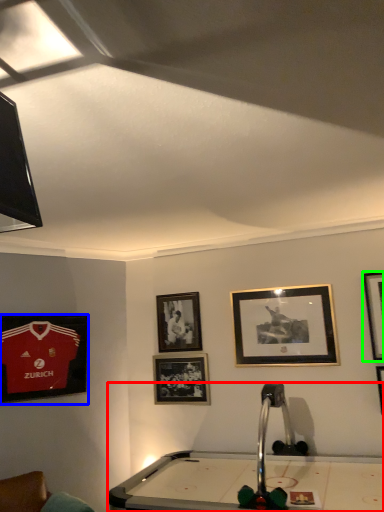
Question: Which object is positioned closest to billiard table (highlighted by a red box)? Select from picture frame (highlighted by a blue box) and picture frame (highlighted by a green box).

Choices:
 (A) picture frame
 (B) picture frame

Answer: (B)